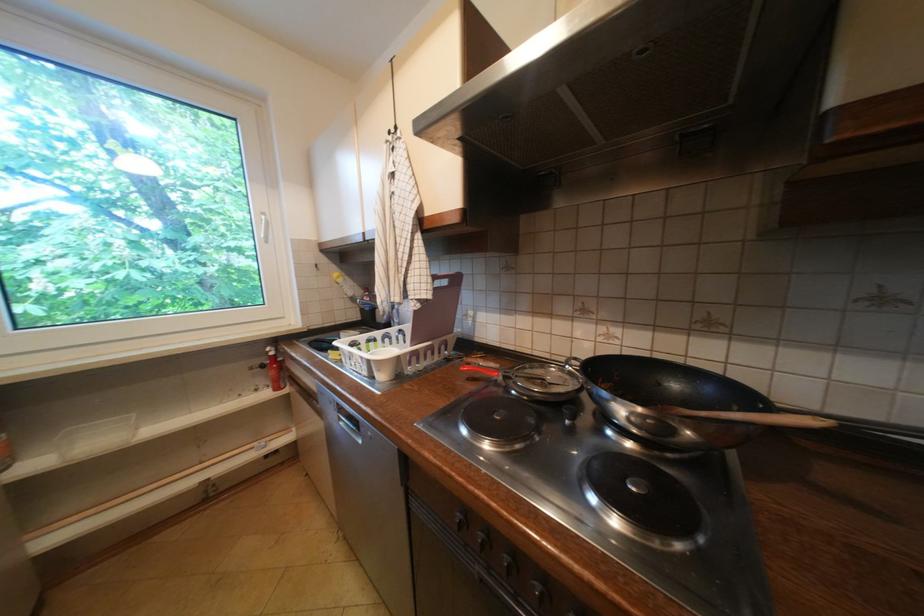
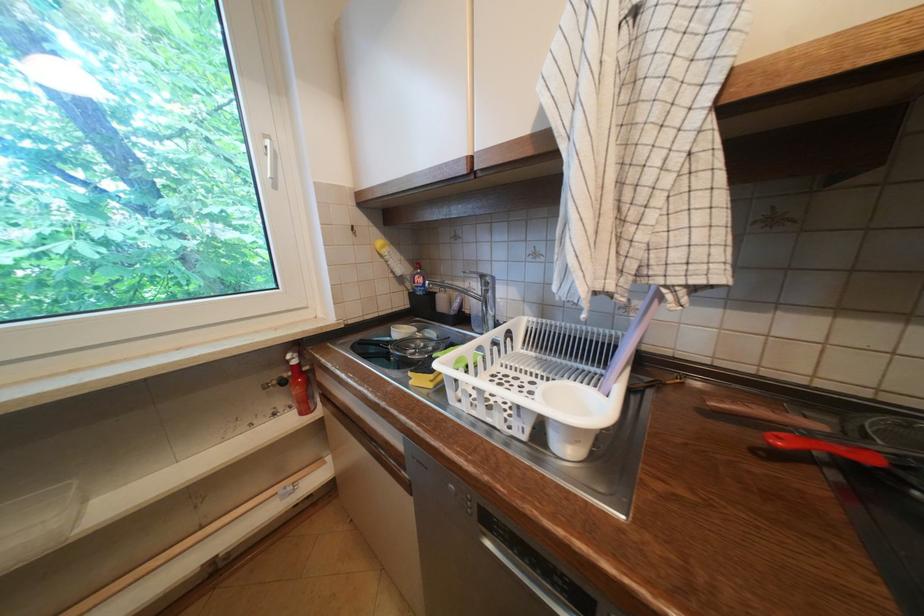
Where in the second image is the point corresponding to (338,358) from the first image?

(419, 383)